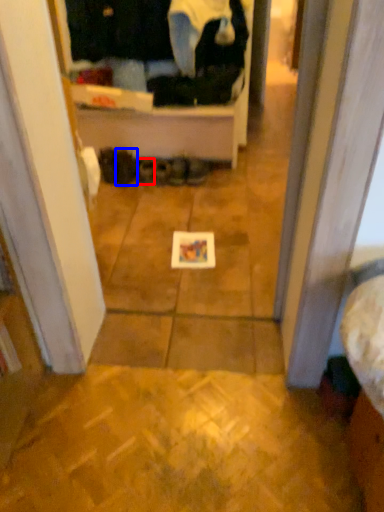
Question: Among these objects, which one is farthest to the camera, footwear (highlighted by a red box) or footwear (highlighted by a blue box)?

Choices:
 (A) footwear
 (B) footwear

Answer: (A)